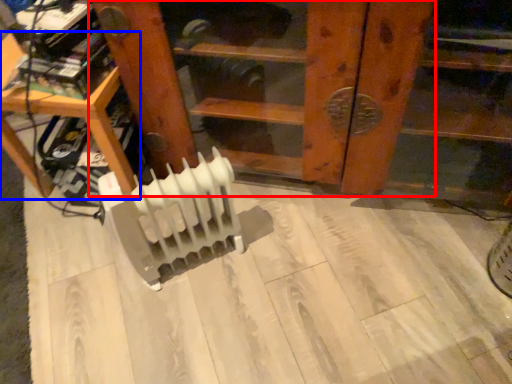
Question: Which point is further to the camera, furniture (highlighted by a red box) or furniture (highlighted by a blue box)?

Choices:
 (A) furniture
 (B) furniture

Answer: (B)